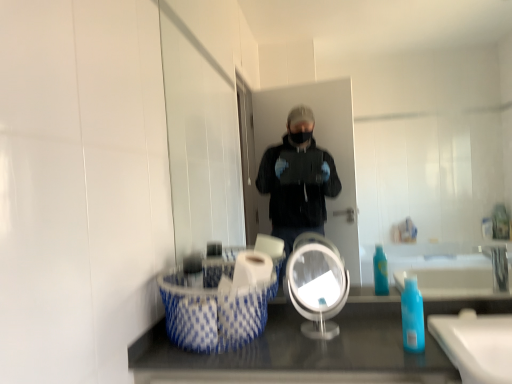
Question: Does blue and white woven laundry basket at lower left have a larger size compared to white glossy toilet paper at center?

Choices:
 (A) no
 (B) yes

Answer: (B)

Question: From the image's perspective, is blue and white woven laundry basket at lower left located beneath white glossy toilet paper at center?

Choices:
 (A) yes
 (B) no

Answer: (A)

Question: Would you say blue and white woven laundry basket at lower left is outside white glossy toilet paper at center?

Choices:
 (A) yes
 (B) no

Answer: (A)

Question: Considering the relative sizes of blue and white woven laundry basket at lower left and white glossy toilet paper at center in the image provided, is blue and white woven laundry basket at lower left taller than white glossy toilet paper at center?

Choices:
 (A) no
 (B) yes

Answer: (B)

Question: Does blue and white woven laundry basket at lower left contain white glossy toilet paper at center?

Choices:
 (A) no
 (B) yes

Answer: (B)

Question: From a real-world perspective, is blue and white woven laundry basket at lower left on white glossy toilet paper at center?

Choices:
 (A) yes
 (B) no

Answer: (B)

Question: Considering the relative positions of clear glass mirror at center, the second mirror viewed from the front, and clear plastic mirror at center, the first mirror positioned from the front, in the image provided, is clear glass mirror at center, the second mirror viewed from the front, to the left of clear plastic mirror at center, the first mirror positioned from the front, from the viewer's perspective?

Choices:
 (A) no
 (B) yes

Answer: (A)

Question: Is clear plastic mirror at center, positioned as the 2th mirror in back-to-front order, surrounded by clear glass mirror at center, the second mirror viewed from the front?

Choices:
 (A) no
 (B) yes

Answer: (A)

Question: Is clear glass mirror at center, the second mirror viewed from the front, at the right side of clear plastic mirror at center, positioned as the 2th mirror in back-to-front order?

Choices:
 (A) no
 (B) yes

Answer: (B)

Question: From the image's perspective, is clear glass mirror at center, the second mirror viewed from the front, under clear plastic mirror at center, positioned as the 2th mirror in back-to-front order?

Choices:
 (A) no
 (B) yes

Answer: (A)

Question: Is clear glass mirror at center, the second mirror viewed from the front, completely or partially outside of clear plastic mirror at center, positioned as the 2th mirror in back-to-front order?

Choices:
 (A) no
 (B) yes

Answer: (B)

Question: Can you see clear glass mirror at center, the second mirror viewed from the front, touching clear plastic mirror at center, positioned as the 2th mirror in back-to-front order?

Choices:
 (A) no
 (B) yes

Answer: (A)

Question: Is blue translucent bottle at lower right outside clear glass mirror at center, which is the 1th mirror from back to front?

Choices:
 (A) yes
 (B) no

Answer: (A)